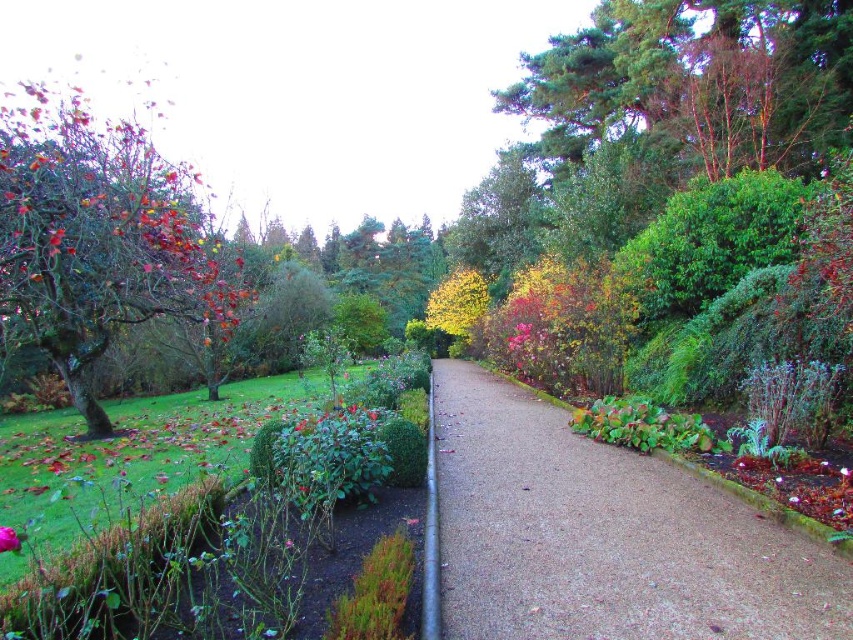
Question: Among these objects, which one is farthest from the camera?

Choices:
 (A) autumn leaves at left
 (B) gravel at center

Answer: (A)

Question: Which point appears closest to the camera in this image?

Choices:
 (A) (16, 536)
 (B) (838, 580)
 (C) (151, 163)

Answer: (A)

Question: Which object is closer to the camera taking this photo?

Choices:
 (A) gravel at center
 (B) purple matte flower at lower left
 (C) autumn leaves at left

Answer: (B)

Question: Does autumn leaves at left have a greater width compared to purple matte flower at lower left?

Choices:
 (A) yes
 (B) no

Answer: (A)

Question: Is autumn leaves at left positioned at the back of purple matte flower at lower left?

Choices:
 (A) no
 (B) yes

Answer: (B)

Question: Can you confirm if gravel at center is bigger than purple matte flower at lower left?

Choices:
 (A) yes
 (B) no

Answer: (A)